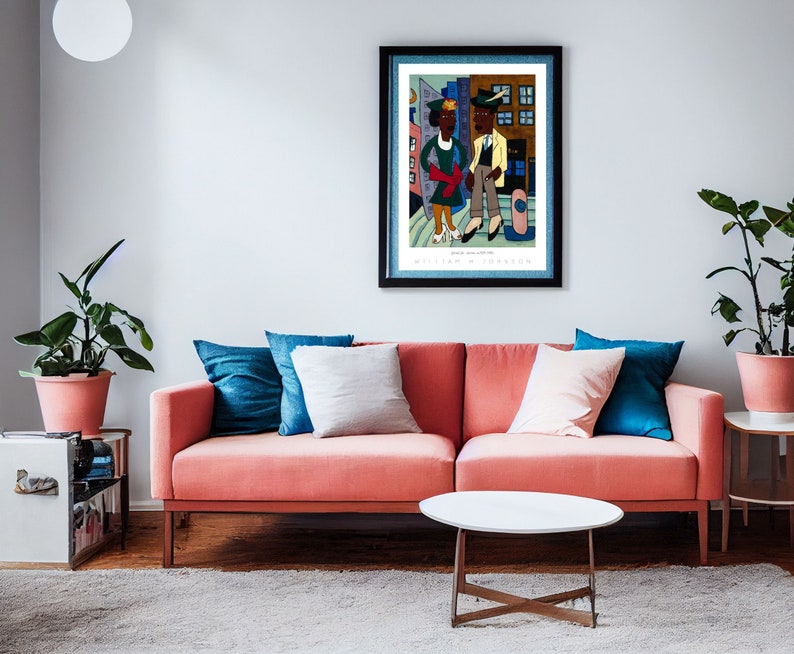
Locate an element on the screen. blue matting surround wall art in frame is located at coordinates (395, 269), (540, 277), (550, 142), (394, 128).